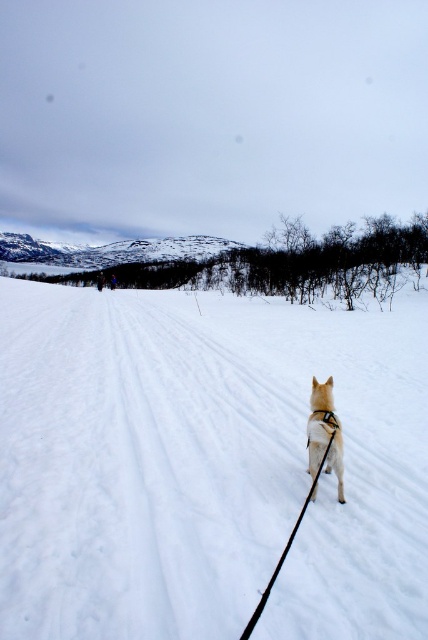
Question: Can you confirm if white fluffy snow at center is bigger than white fur dog at center?

Choices:
 (A) yes
 (B) no

Answer: (A)

Question: Is white fluffy snow at center bigger than white fur dog at center?

Choices:
 (A) no
 (B) yes

Answer: (B)

Question: Does white fluffy snow at center have a greater width compared to white fur dog at center?

Choices:
 (A) yes
 (B) no

Answer: (A)